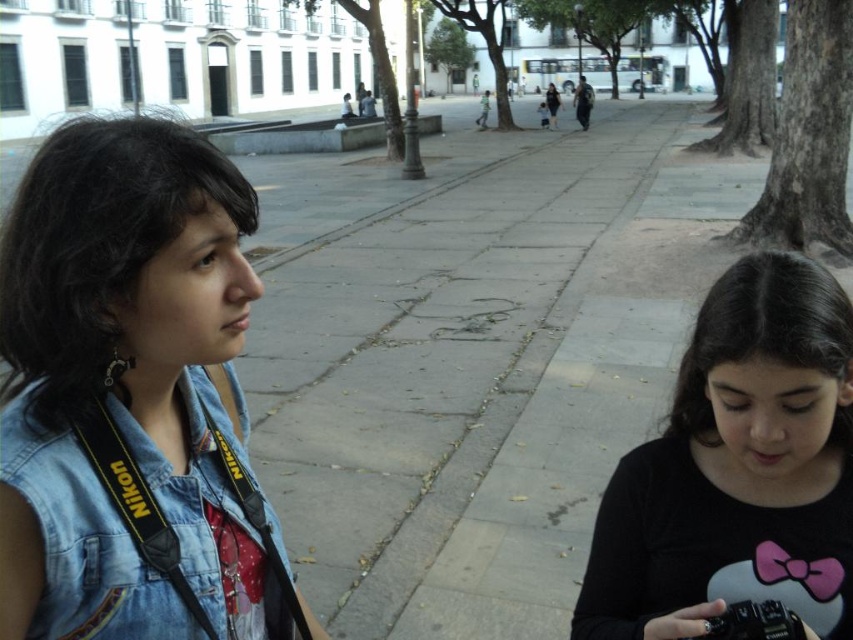
Does denim jacket at lower left appear over black plastic camera at lower right?

Yes.

Can you confirm if denim jacket at lower left is thinner than black plastic camera at lower right?

Incorrect, denim jacket at lower left's width is not less than black plastic camera at lower right's.

What do you see at coordinates (84, 541) in the screenshot?
I see `denim jacket at lower left` at bounding box center [84, 541].

Find the location of a particular element. Image resolution: width=853 pixels, height=640 pixels. denim jacket at lower left is located at coordinates (84, 541).

Which is in front, point (10, 241) or point (715, 616)?

Point (10, 241) is in front.

Can you confirm if denim jacket at left is smaller than black plastic camera at lower right?

No.

Does point (164, 221) lie behind point (791, 636)?

That is False.

Image resolution: width=853 pixels, height=640 pixels. Identify the location of denim jacket at left. (132, 397).

Is denim jacket at left thinner than black matte shirt at center?

Correct, denim jacket at left's width is less than black matte shirt at center's.

Based on the photo, is denim jacket at left shorter than black matte shirt at center?

Incorrect, denim jacket at left's height does not fall short of black matte shirt at center's.

I want to click on denim jacket at left, so click(132, 397).

This screenshot has width=853, height=640. Identify the location of denim jacket at left. (132, 397).